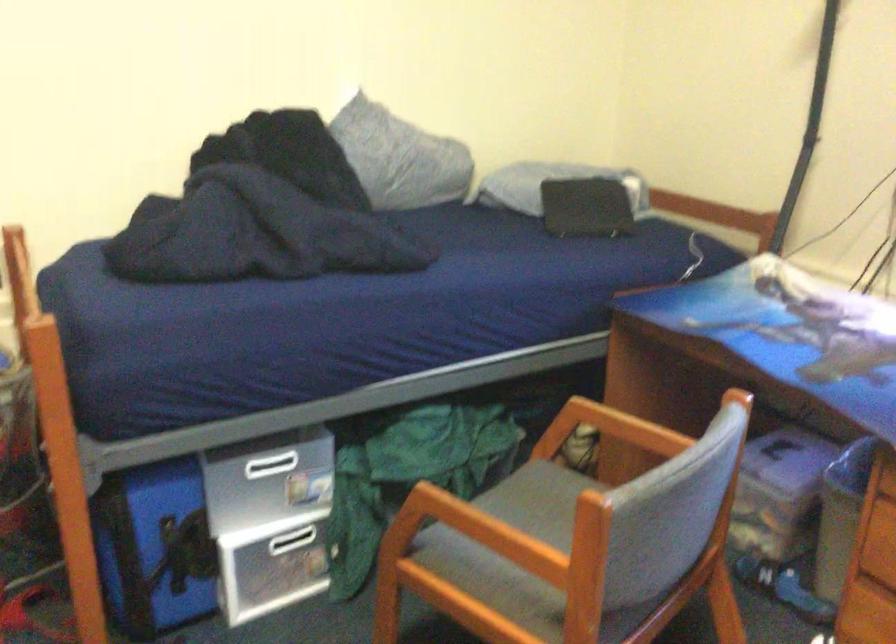
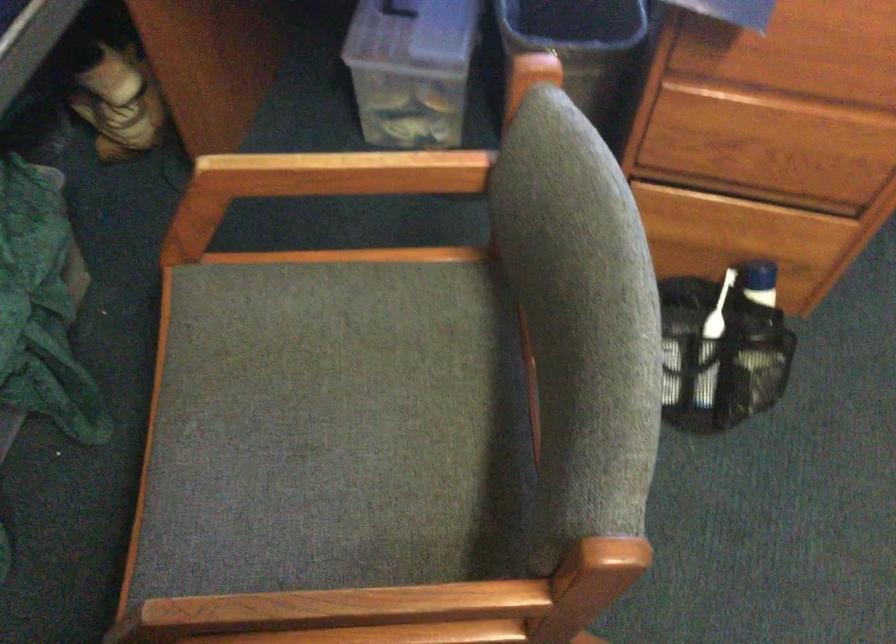
First-person continuous shooting, in which direction is the camera rotating?

The rotation direction of the camera is right-down.